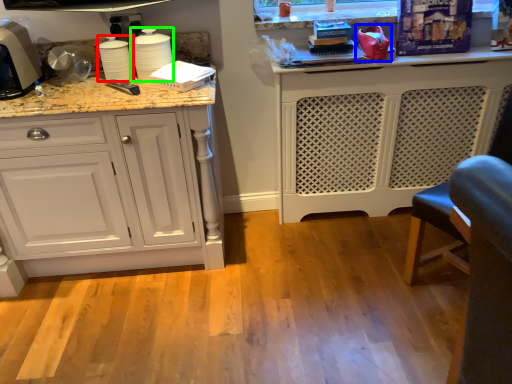
Question: Which object is the closest to the appliance (highlighted by a red box)? Choose among these: appliance (highlighted by a blue box) or appliance (highlighted by a green box).

Choices:
 (A) appliance
 (B) appliance

Answer: (B)